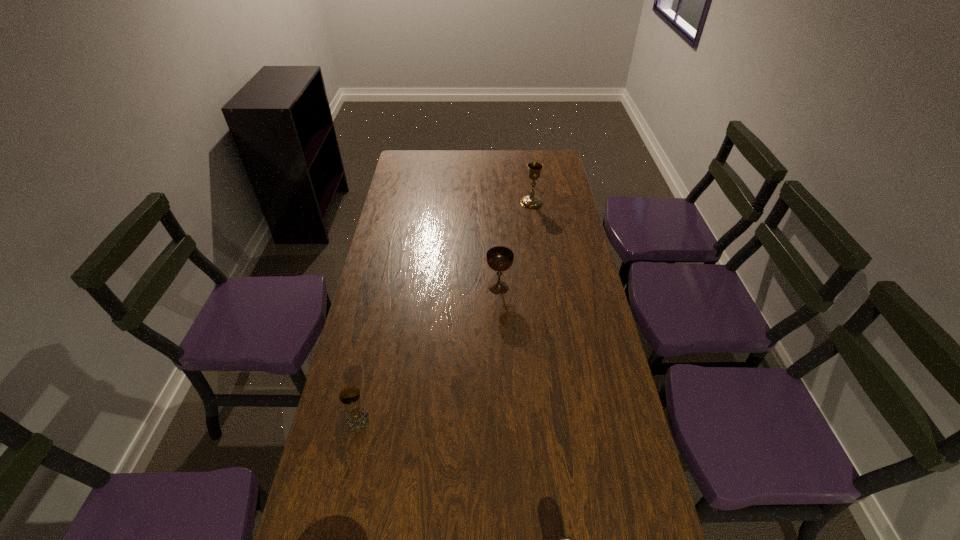
This screenshot has width=960, height=540. Find the location of `object located at the right edge`. object located at the right edge is located at coordinates (529, 201).

Locate an element on the screen. vacant space at the far edge of the desktop is located at coordinates (455, 156).

Locate an element on the screen. free space at the left edge of the desktop is located at coordinates (368, 282).

Where is `vacant space at the right edge of the desktop`? vacant space at the right edge of the desktop is located at coordinates (551, 276).

This screenshot has width=960, height=540. In order to click on free space at the far right corner in this screenshot , I will do `click(549, 172)`.

The height and width of the screenshot is (540, 960). Find the location of `vacant area that lies between the leftmost object and the farthest chalice`. vacant area that lies between the leftmost object and the farthest chalice is located at coordinates (444, 311).

Locate an element on the screen. This screenshot has height=540, width=960. vacant area that lies between the rightmost chalice and the second farthest chalice is located at coordinates (516, 245).

Locate an element on the screen. Image resolution: width=960 pixels, height=540 pixels. blank region between the second object from left to right and the farthest chalice is located at coordinates (516, 245).

This screenshot has width=960, height=540. I want to click on vacant point located between the third shortest object and the nearest chalice, so click(428, 354).

Find the location of a particular element. object that can be found as the closest to the leftmost object is located at coordinates (564, 539).